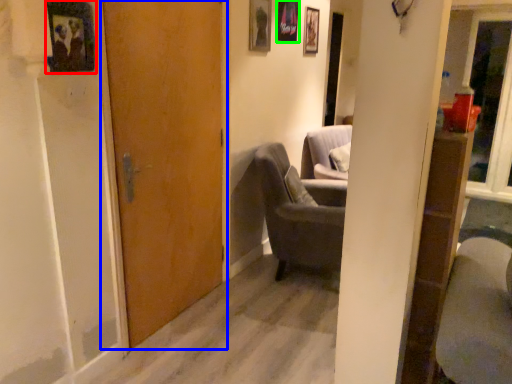
Question: Estimate the real-world distances between objects in this image. Which object is closer to picture frame (highlighted by a red box), door (highlighted by a blue box) or picture frame (highlighted by a green box)?

Choices:
 (A) door
 (B) picture frame

Answer: (A)